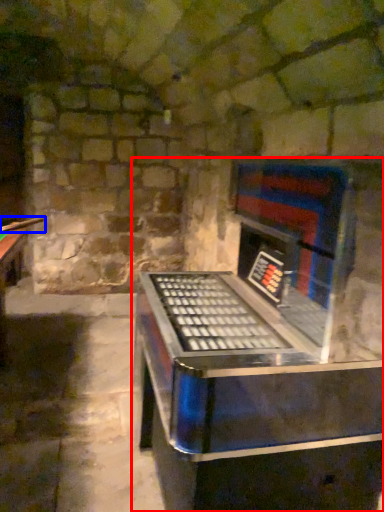
Question: Among these objects, which one is nearest to the camera, furniture (highlighted by a red box) or cue (highlighted by a blue box)?

Choices:
 (A) furniture
 (B) cue

Answer: (A)